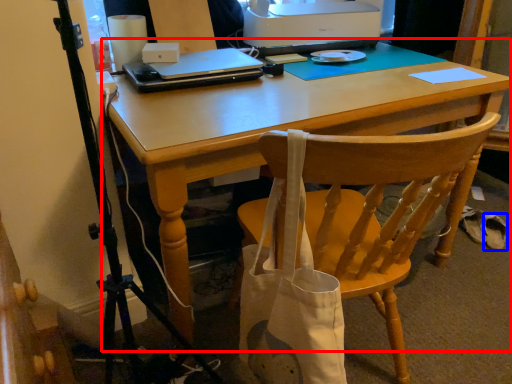
Question: Which point is closer to the camera, computer desk (highlighted by a red box) or walking shoe (highlighted by a blue box)?

Choices:
 (A) computer desk
 (B) walking shoe

Answer: (A)